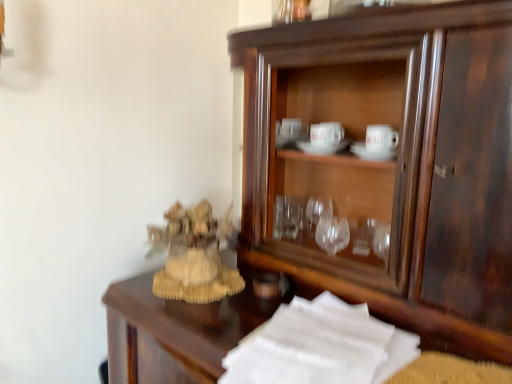
Image resolution: width=512 pixels, height=384 pixels. What do you see at coordinates (320, 346) in the screenshot? I see `white paper at lower right` at bounding box center [320, 346].

What are the coordinates of `dark wood cupboard at center` in the screenshot? It's located at (393, 163).

From a real-world perspective, relative to white paper at lower right, is beige woven statue at left vertically above or below?

Clearly, from a real-world perspective, beige woven statue at left is above white paper at lower right.

Is beige woven statue at left located outside white paper at lower right?

Yes, beige woven statue at left is not within white paper at lower right.

Is point (178, 232) in front of point (321, 311)?

No.

Looking at this image, from the image's perspective, is white paper at lower right beneath beige woven statue at left?

Yes, from the image's perspective, white paper at lower right is below beige woven statue at left.

Is point (341, 349) less distant than point (191, 263)?

Yes, point (341, 349) is closer to viewer.

From a real-world perspective, is white paper at lower right physically above beige woven statue at left?

No, from a real-world perspective, white paper at lower right is not on top of beige woven statue at left.

In terms of size, does dark wood cupboard at center appear bigger or smaller than white paper at lower right?

In the image, dark wood cupboard at center appears to be larger than white paper at lower right.

From the image's perspective, which one is positioned lower, dark wood cupboard at center or white paper at lower right?

white paper at lower right is shown below in the image.

Which object is positioned more to the right, dark wood cupboard at center or white paper at lower right?

dark wood cupboard at center is more to the right.

Can you see dark wood cupboard at center touching white paper at lower right?

dark wood cupboard at center and white paper at lower right are clearly separated.

How distant is white paper at lower right from dark wood cupboard at center?

They are 29.58 centimeters apart.

Considering the positions of objects white paper at lower right and dark wood cupboard at center in the image provided, who is more to the left, white paper at lower right or dark wood cupboard at center?

Positioned to the left is white paper at lower right.

From the image's perspective, between white paper at lower right and dark wood cupboard at center, who is located below?

white paper at lower right.

Is white paper at lower right surrounding dark wood cupboard at center?

Actually, dark wood cupboard at center is outside white paper at lower right.

Find the location of `toy that is on the left side of dark wood cupboard at center`. toy that is on the left side of dark wood cupboard at center is located at coordinates [x=194, y=255].

From the image's perspective, would you say beige woven statue at left is positioned over dark wood cupboard at center?

No.

Measure the distance from dark wood cupboard at center to beige woven statue at left.

A distance of 12.02 inches exists between dark wood cupboard at center and beige woven statue at left.

Is dark wood cupboard at center not near beige woven statue at left?

No, there isn't a large distance between dark wood cupboard at center and beige woven statue at left.

In the scene shown: Does dark wood cupboard at center turn towards beige woven statue at left?

Yes, dark wood cupboard at center is aimed at beige woven statue at left.

Is dark wood cupboard at center wider or thinner than beige woven statue at left?

Clearly, dark wood cupboard at center has more width compared to beige woven statue at left.

Image resolution: width=512 pixels, height=384 pixels. In the image, there is a white paper at lower right. What are the coordinates of `toy above it (from the image's perspective)` in the screenshot? It's located at (194, 255).

Locate an element on the screen. The image size is (512, 384). toy behind the white paper at lower right is located at coordinates (194, 255).

Which object lies nearer to the anchor point white paper at lower right, dark wood cupboard at center or beige woven statue at left?

beige woven statue at left is positioned closer to the anchor white paper at lower right.

Based on their spatial positions, is dark wood cupboard at center or white paper at lower right further from beige woven statue at left?

dark wood cupboard at center is further to beige woven statue at left.

When comparing their distances from dark wood cupboard at center, does white paper at lower right or beige woven statue at left seem closer?

Based on the image, white paper at lower right appears to be nearer to dark wood cupboard at center.

Estimate the real-world distances between objects in this image. Which object is closer to white paper at lower right, beige woven statue at left or dark wood cupboard at center?

Among the two, beige woven statue at left is located nearer to white paper at lower right.

When comparing their distances from dark wood cupboard at center, does beige woven statue at left or white paper at lower right seem closer?

white paper at lower right lies closer to dark wood cupboard at center than the other object.

Estimate the real-world distances between objects in this image. Which object is closer to beige woven statue at left, white paper at lower right or dark wood cupboard at center?

Among the two, white paper at lower right is located nearer to beige woven statue at left.

Locate an element on the screen. paper between beige woven statue at left and dark wood cupboard at center from left to right is located at coordinates (320, 346).